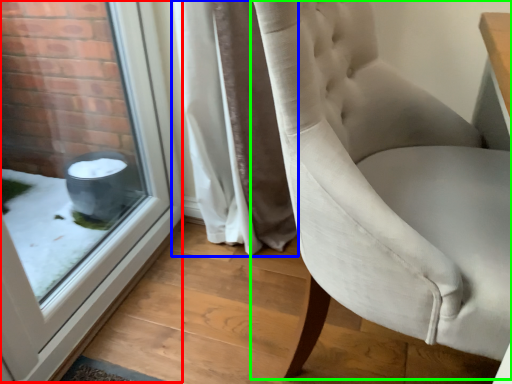
Question: Which object is the closest to the window (highlighted by a red box)? Choose among these: curtain (highlighted by a blue box) or chair (highlighted by a green box).

Choices:
 (A) curtain
 (B) chair

Answer: (A)